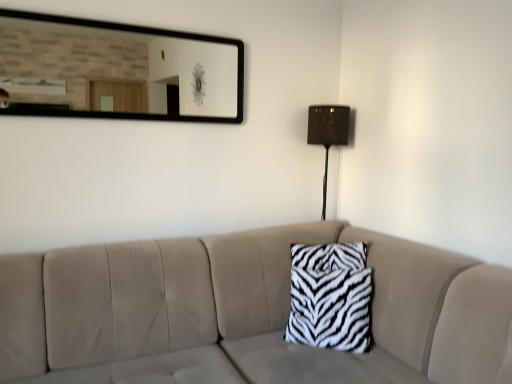
Question: In terms of size, does white zebra-patterned pillow at center appear bigger or smaller than zebra-patterned fabric pillow at center?

Choices:
 (A) small
 (B) big

Answer: (B)

Question: Is white zebra-patterned pillow at center wider or thinner than zebra-patterned fabric pillow at center?

Choices:
 (A) wide
 (B) thin

Answer: (A)

Question: Which is nearer to the black-framed mirror at upper center?

Choices:
 (A) matte brown table lamp at right
 (B) zebra-patterned fabric pillow at center
 (C) white zebra-patterned pillow at center

Answer: (A)

Question: Considering the real-world distances, which object is farthest from the zebra-patterned fabric pillow at center?

Choices:
 (A) matte brown table lamp at right
 (B) black-framed mirror at upper center
 (C) white zebra-patterned pillow at center

Answer: (B)